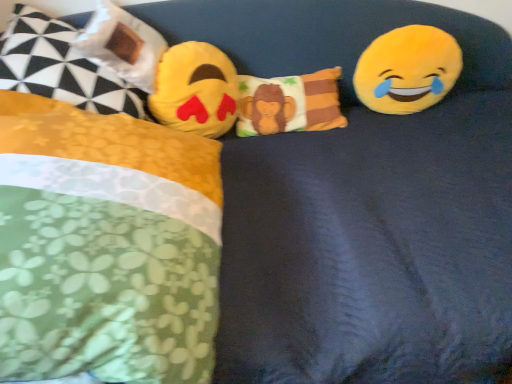
The width and height of the screenshot is (512, 384). In order to click on free point above floral fabric pillow at left, which ranks as the fourth pillow in right-to-left order (from a real-world perspective) in this screenshot , I will do `click(52, 28)`.